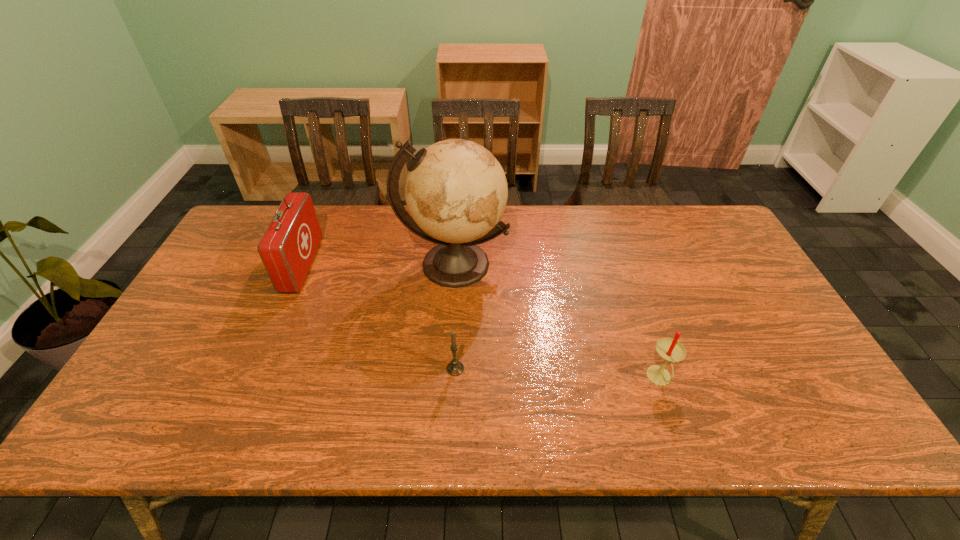
Where is `the tallest object`? The width and height of the screenshot is (960, 540). the tallest object is located at coordinates (456, 191).

Image resolution: width=960 pixels, height=540 pixels. I want to click on the first-aid kit, so click(287, 249).

Identify the location of the second tallest object. This screenshot has height=540, width=960. (287, 249).

The height and width of the screenshot is (540, 960). I want to click on the rightmost object, so (670, 350).

I want to click on the taller candle, so click(x=670, y=350).

Image resolution: width=960 pixels, height=540 pixels. Find the location of `the left candle`. the left candle is located at coordinates (455, 367).

The height and width of the screenshot is (540, 960). I want to click on the shortest object, so click(x=455, y=367).

This screenshot has height=540, width=960. I want to click on vacant area located 0.130m on the front-facing side of the tallest object, so click(x=449, y=333).

This screenshot has height=540, width=960. In order to click on free space located 0.090m on the side of the first-aid kit with the first aid cross symbol in this screenshot , I will do `click(343, 266)`.

This screenshot has height=540, width=960. I want to click on vacant area situated 0.080m on the back of the right candle, so click(646, 339).